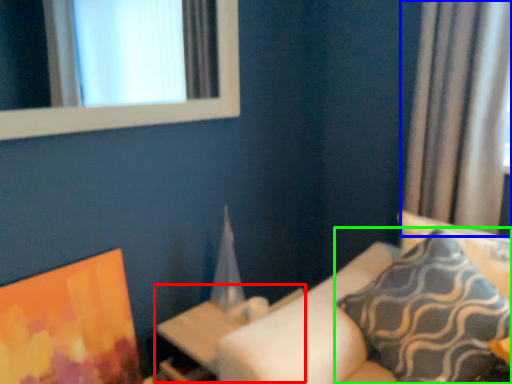
Question: Based on their relative distances, which object is farther from table (highlighted by a red box)? Choose from curtain (highlighted by a blue box) and pillow (highlighted by a green box).

Choices:
 (A) curtain
 (B) pillow

Answer: (A)